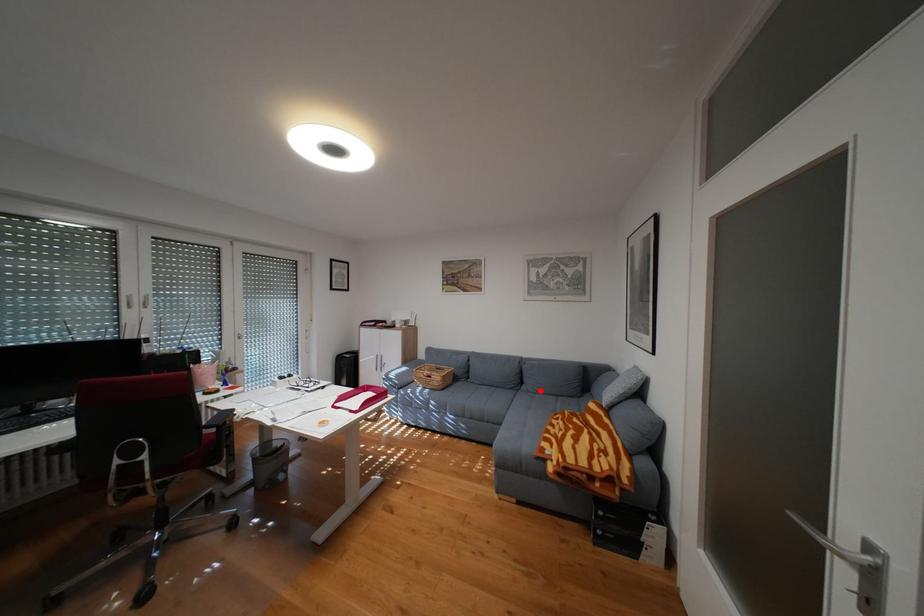
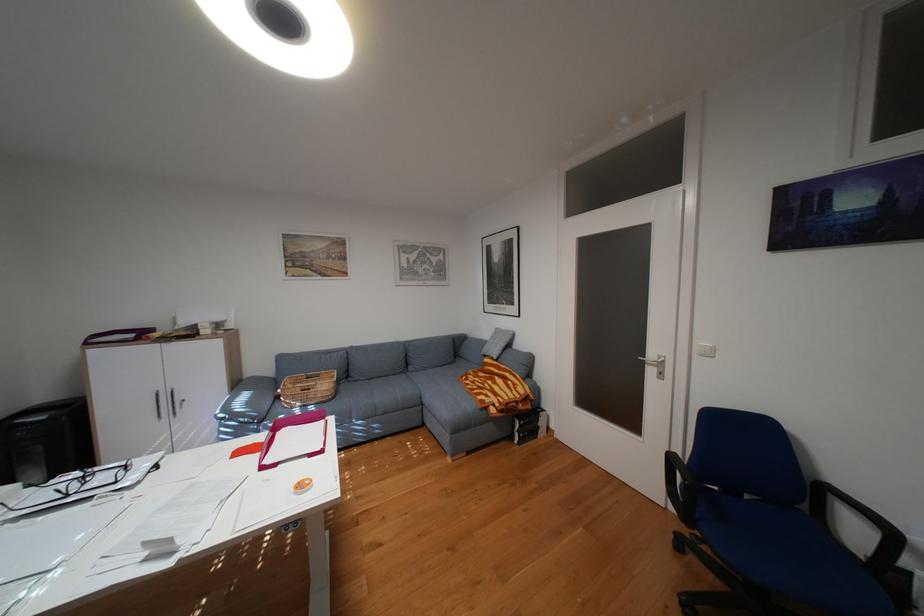
Where in the second image is the point corresponding to the highlighted location from the first image?

(430, 370)